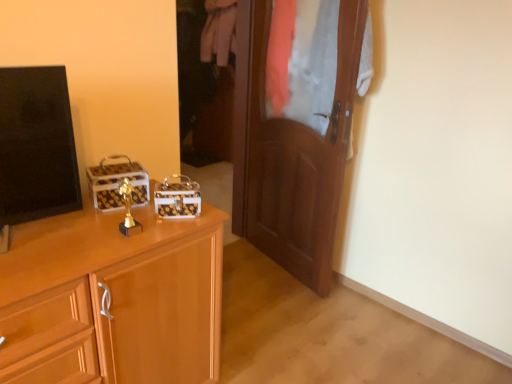
The height and width of the screenshot is (384, 512). Identify the location of vacant space situated above matte wood cabinet at left (from a real-world perspective). (70, 238).